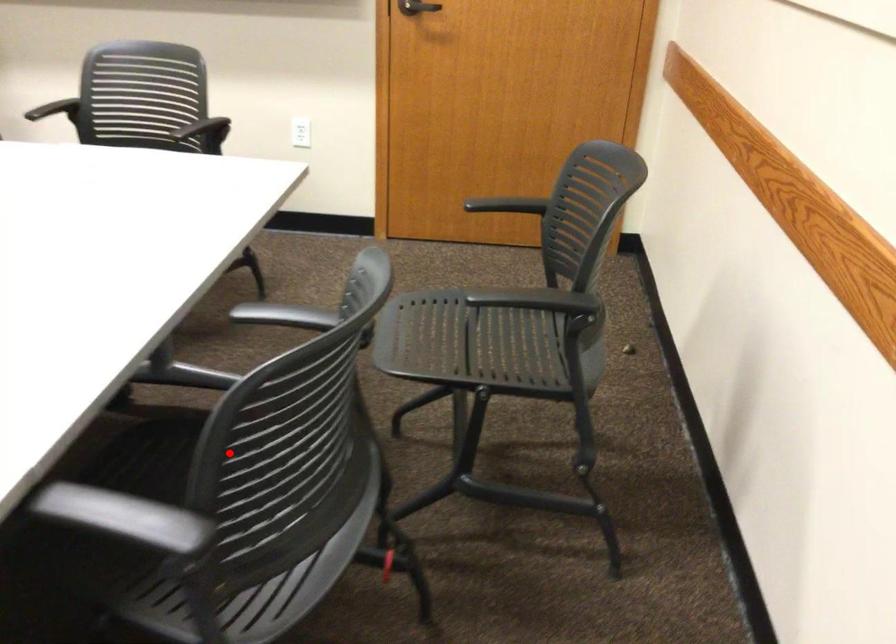
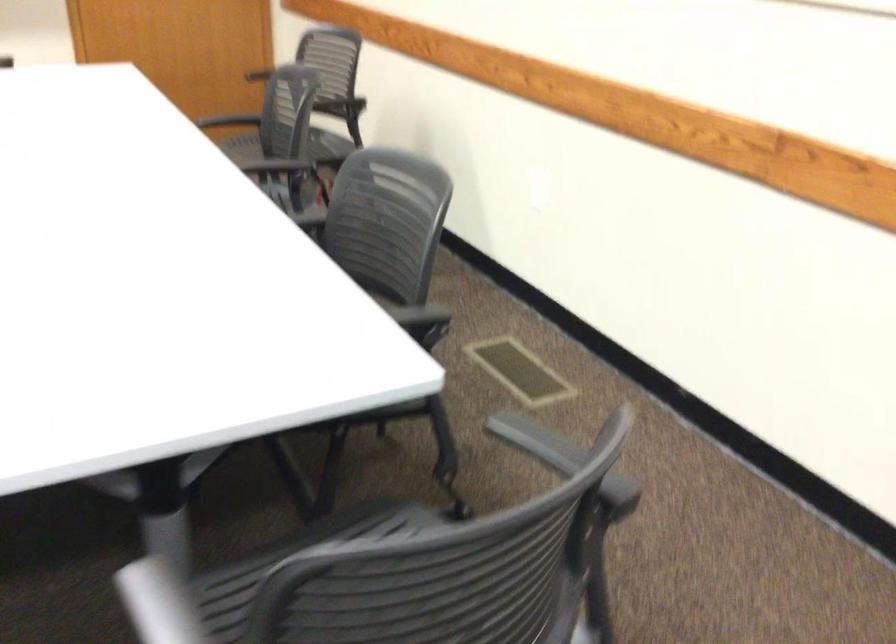
Question: I am providing you with two images of the same scene from different viewpoints. In image1, a red point is highlighted. Considering the same 3D point in image2, which of the following is correct?

Choices:
 (A) It is closer
 (B) It is farther

Answer: (B)